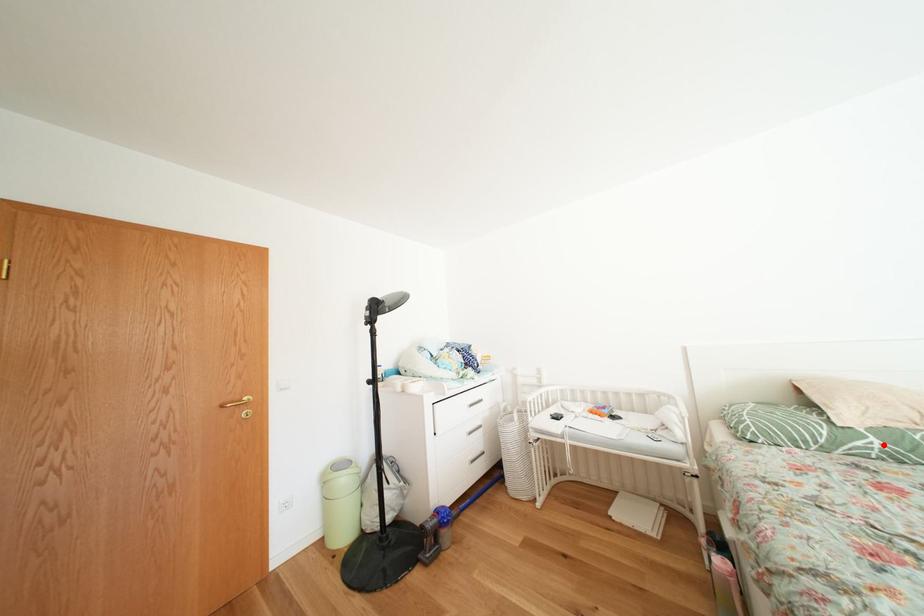
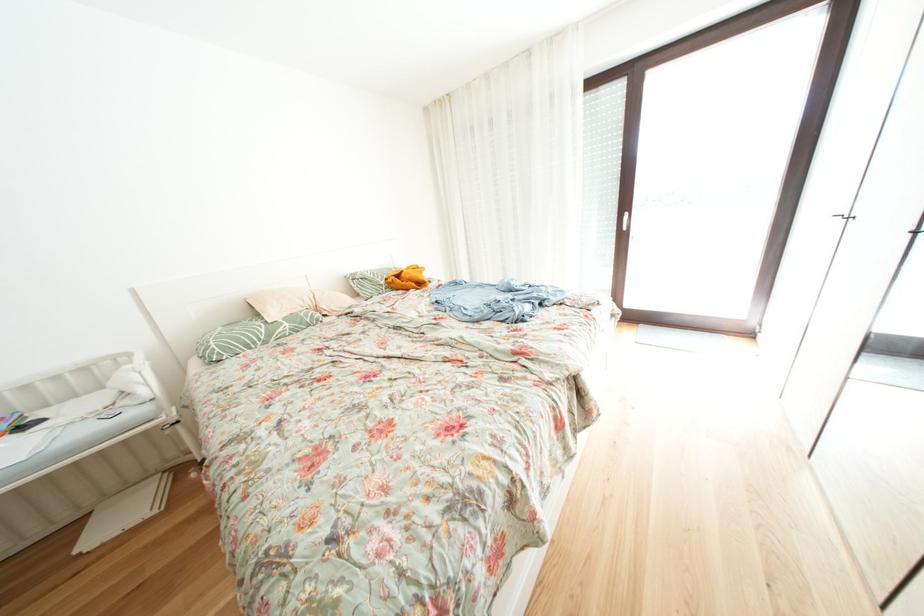
In the second image, find the point that corresponds to the highlighted location in the first image.

(296, 329)